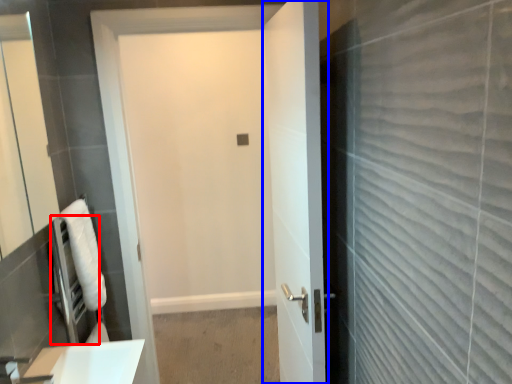
Question: Which object is closer to the camera taking this photo, appliance (highlighted by a red box) or door (highlighted by a blue box)?

Choices:
 (A) appliance
 (B) door

Answer: (B)